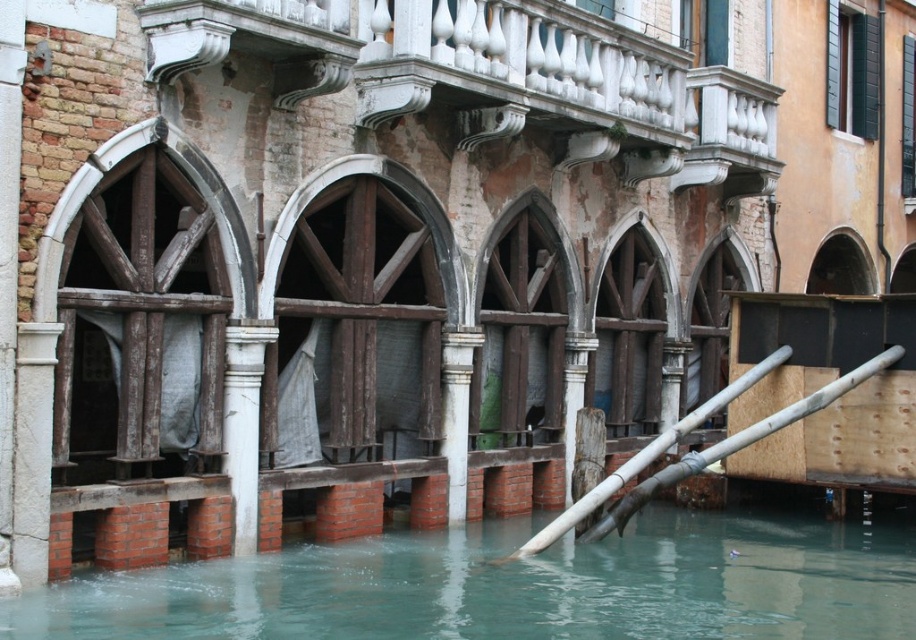
You are a tourist visiting Venice and want to take a photo of the historic building. You notice the smooth bamboo pole at lower right and the white stone column at center. Which object should you focus on if you want to capture the taller one in your photo?

The smooth bamboo pole at lower right is much taller than the white stone column at center, so you should focus on the smooth bamboo pole at lower right to capture the taller one in your photo.

You are a tourist standing in front of the historic building in Venice. You notice the smooth bamboo pole at lower right and the white stone column at center. Which object is closer to the water level?

The smooth bamboo pole at lower right is located below the white stone column at center, so it is closer to the water level.

You are a tourist visiting Venice and want to take a photo of the clear water at lower center and the green wood archway at center. Which object in the scene is larger?

The clear water at lower center is bigger than the green wood archway at center.